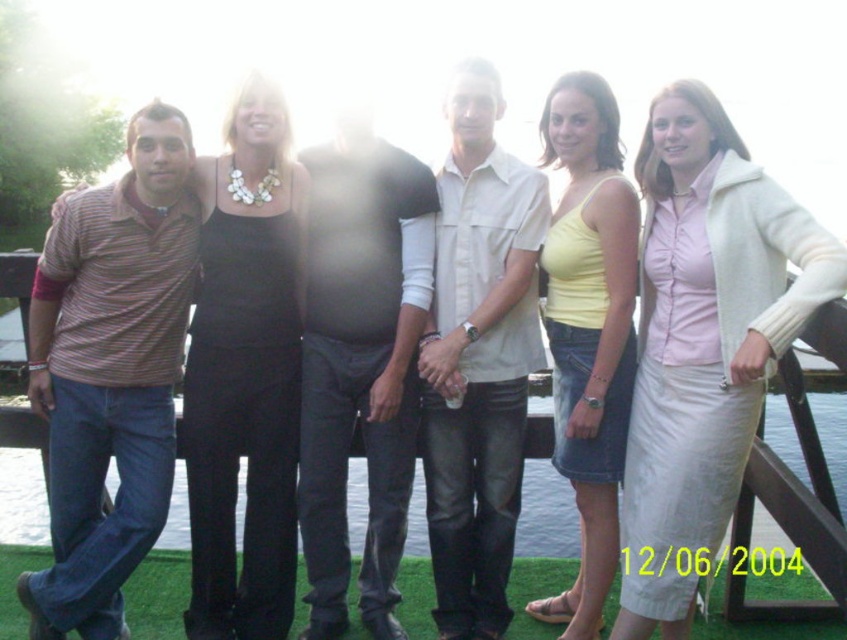
Does dark gray jeans at center have a greater width compared to matte yellow tank top at center?

Yes.

Which is below, dark gray jeans at center or matte yellow tank top at center?

dark gray jeans at center

Who is more forward, (342, 224) or (612, 148)?

Point (612, 148)

In order to click on dark gray jeans at center in this screenshot , I will do `click(360, 362)`.

Can you confirm if matte yellow tank top at center is wider than clear water at lower left?

No, matte yellow tank top at center is not wider than clear water at lower left.

This screenshot has width=847, height=640. Identify the location of matte yellow tank top at center. (588, 330).

Measure the distance between point (x=375, y=264) and camera.

They are 7.54 meters apart.

In the scene shown: Who is higher up, dark gray jeans at center or clear water at lower left?

dark gray jeans at center

Locate an element on the screen. The height and width of the screenshot is (640, 847). dark gray jeans at center is located at coordinates (360, 362).